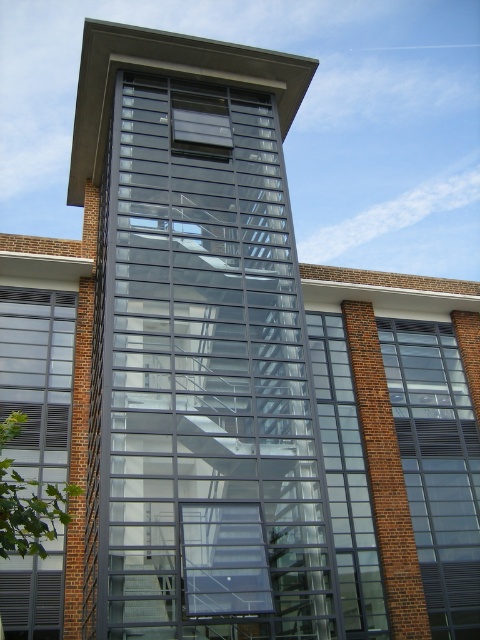
Question: Among these points, which one is nearest to the camera?

Choices:
 (A) (14, 352)
 (B) (324, 472)

Answer: (B)

Question: Is transparent glass tower at center bigger than transparent glass window at right?

Choices:
 (A) yes
 (B) no

Answer: (A)

Question: Can you confirm if transparent glass window at right is wider than clear glass window at left?

Choices:
 (A) no
 (B) yes

Answer: (B)

Question: Is transparent glass tower at center below clear glass window at left?

Choices:
 (A) no
 (B) yes

Answer: (A)

Question: Which point is closer to the camera?

Choices:
 (A) clear glass window at left
 (B) transparent glass tower at center
 (C) transparent glass window at right

Answer: (B)

Question: Which is farther from the transparent glass window at right?

Choices:
 (A) transparent glass tower at center
 (B) clear glass window at left

Answer: (A)